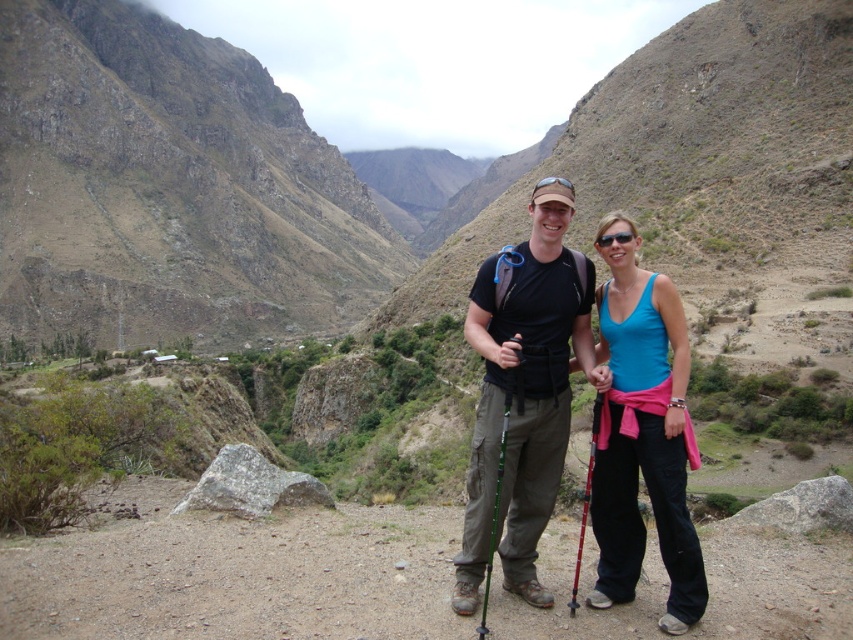
Between point (207, 310) and point (486, 573), which one is positioned in front?

Point (486, 573)

At what (x,y) coordinates should I click in order to perform the action: click on dull brown rock at upper left. Please return your answer as a coordinate pair (x, y). Image resolution: width=853 pixels, height=640 pixels. Looking at the image, I should click on (169, 189).

In the scene shown: Can you confirm if blue fabric tank top at center is bigger than pink plastic ski pole at center-right?

Indeed, blue fabric tank top at center has a larger size compared to pink plastic ski pole at center-right.

In order to click on blue fabric tank top at center in this screenshot , I will do [643, 435].

Does matte black backpack at center have a larger size compared to blue fabric tank top at center?

Actually, matte black backpack at center might be smaller than blue fabric tank top at center.

Which of these two, matte black backpack at center or blue fabric tank top at center, stands taller?

Standing taller between the two is blue fabric tank top at center.

Between point (552, 396) and point (614, 436), which one is positioned in front?

Point (552, 396) is more forward.

Locate an element on the screen. This screenshot has width=853, height=640. matte black backpack at center is located at coordinates (524, 394).